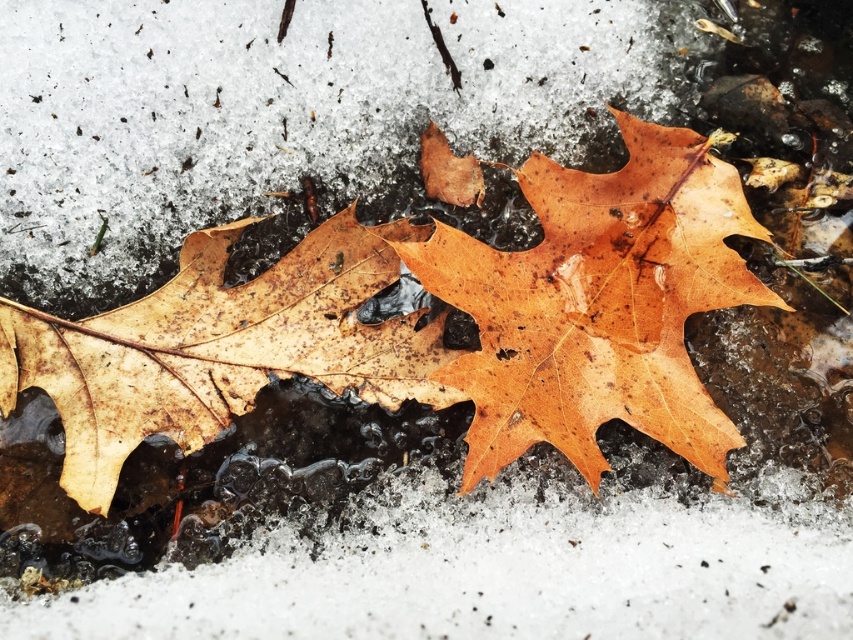
Question: Can you confirm if shiny brown leaf at center is smaller than brown matte leaf at left?

Choices:
 (A) no
 (B) yes

Answer: (A)

Question: Which object appears closest to the camera in this image?

Choices:
 (A) shiny brown leaf at center
 (B) brown matte leaf at left

Answer: (B)

Question: Is shiny brown leaf at center wider than brown matte leaf at left?

Choices:
 (A) no
 (B) yes

Answer: (A)

Question: Which point is farther from the camera taking this photo?

Choices:
 (A) (650, 420)
 (B) (310, 376)

Answer: (B)

Question: In this image, where is shiny brown leaf at center located relative to brown matte leaf at left?

Choices:
 (A) above
 (B) below

Answer: (A)